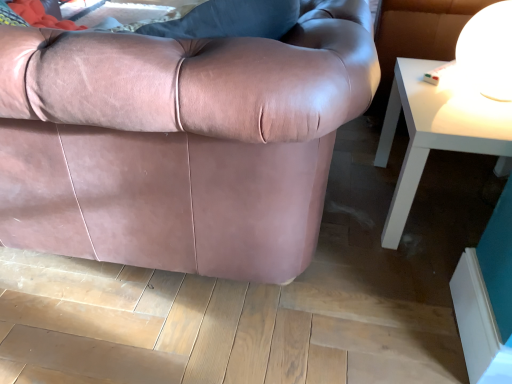
Question: In terms of height, does white glossy table at upper right look taller or shorter compared to white glossy table lamp at upper right?

Choices:
 (A) tall
 (B) short

Answer: (A)

Question: From a real-world perspective, is white glossy table at upper right positioned above or below white glossy table lamp at upper right?

Choices:
 (A) below
 (B) above

Answer: (A)

Question: Which is nearer to the white glossy table lamp at upper right?

Choices:
 (A) white glossy table at upper right
 (B) matte pink leather couch at center

Answer: (A)

Question: Estimate the real-world distances between objects in this image. Which object is closer to the matte pink leather couch at center?

Choices:
 (A) white glossy table at upper right
 (B) white glossy table lamp at upper right

Answer: (A)